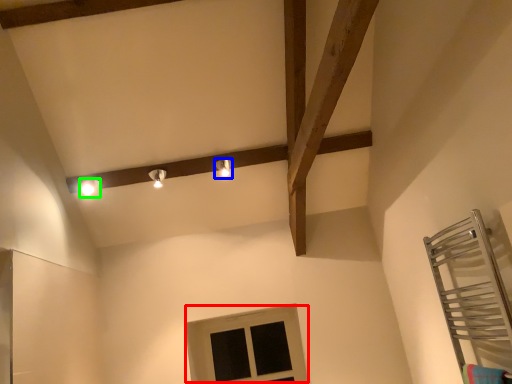
Question: Estimate the real-world distances between objects in this image. Which object is farther from window (highlighted by a red box), light fixture (highlighted by a blue box) or light fixture (highlighted by a green box)?

Choices:
 (A) light fixture
 (B) light fixture

Answer: (B)